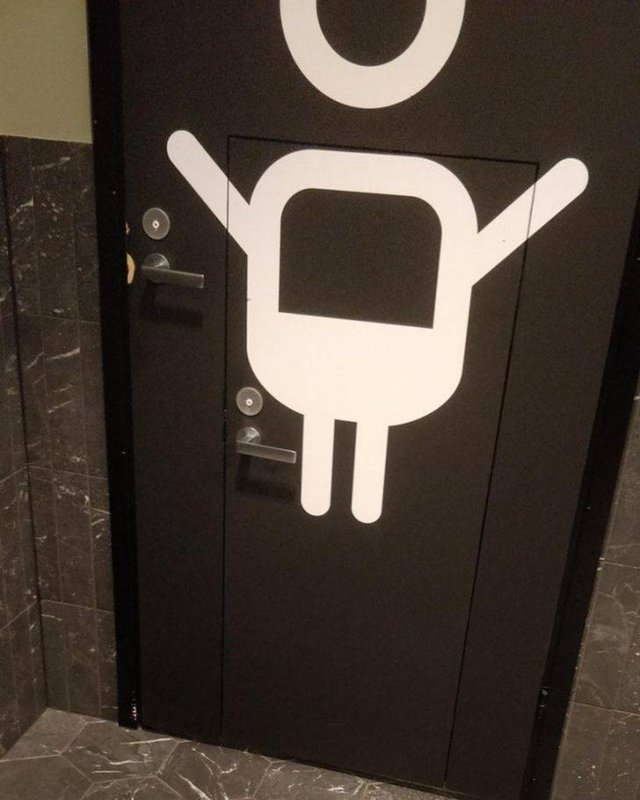
Locate an element on the screen. The height and width of the screenshot is (800, 640). door handle is located at coordinates (244, 446).